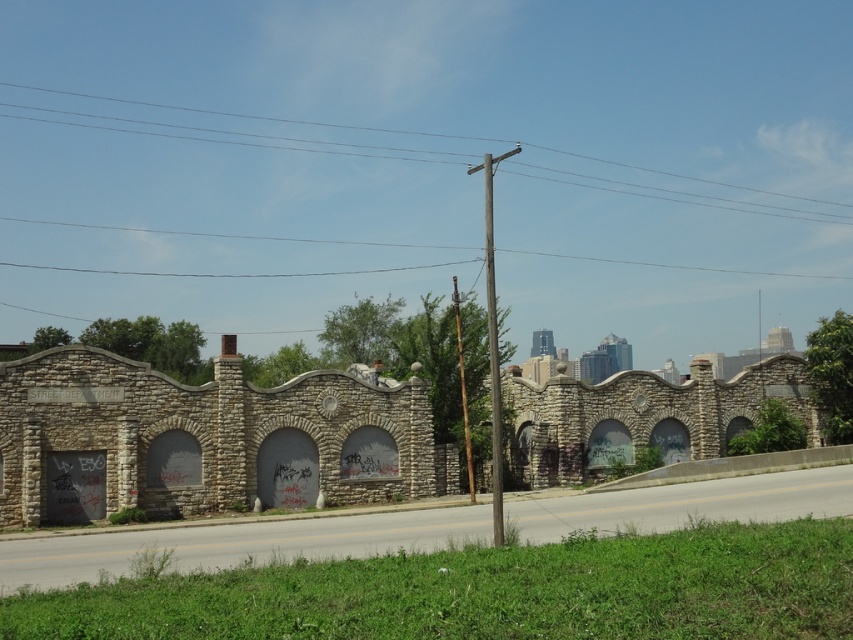
Question: Is gray concrete highway at lower center to the right of wooden pole at upper center from the viewer's perspective?

Choices:
 (A) no
 (B) yes

Answer: (B)

Question: Which point is farther from the camera taking this photo?

Choices:
 (A) (35, 577)
 (B) (132, 129)

Answer: (B)

Question: Which point is closer to the camera?

Choices:
 (A) (670, 193)
 (B) (543, 540)

Answer: (B)

Question: Which object is farther from the camera taking this photo?

Choices:
 (A) gray concrete highway at lower center
 (B) wooden pole at upper center

Answer: (B)

Question: Is gray concrete highway at lower center bigger than wooden pole at upper center?

Choices:
 (A) no
 (B) yes

Answer: (A)

Question: Does gray concrete highway at lower center come in front of wooden pole at upper center?

Choices:
 (A) yes
 (B) no

Answer: (A)